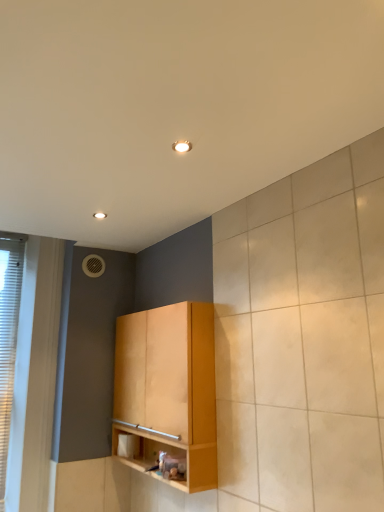
Question: From a real-world perspective, relative to light wood cabinet at center, is white textured window at left vertically above or below?

Choices:
 (A) above
 (B) below

Answer: (A)

Question: From their relative heights in the image, would you say white textured window at left is taller or shorter than light wood cabinet at center?

Choices:
 (A) short
 (B) tall

Answer: (B)

Question: Does point (19, 246) appear closer or farther from the camera than point (119, 430)?

Choices:
 (A) farther
 (B) closer

Answer: (A)

Question: From a real-world perspective, is light wood cabinet at center above or below white textured window at left?

Choices:
 (A) above
 (B) below

Answer: (B)

Question: Is light wood cabinet at center bigger or smaller than white textured window at left?

Choices:
 (A) small
 (B) big

Answer: (B)

Question: In the image, is light wood cabinet at center positioned in front of or behind white textured window at left?

Choices:
 (A) front
 (B) behind

Answer: (A)

Question: Considering the positions of light wood cabinet at center and white textured window at left in the image, is light wood cabinet at center taller or shorter than white textured window at left?

Choices:
 (A) short
 (B) tall

Answer: (A)